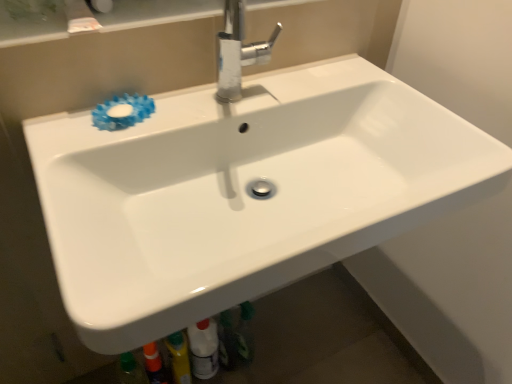
Where is `vacant space situated on the left part of polished chrome faucet at upper center`? The image size is (512, 384). vacant space situated on the left part of polished chrome faucet at upper center is located at coordinates (182, 110).